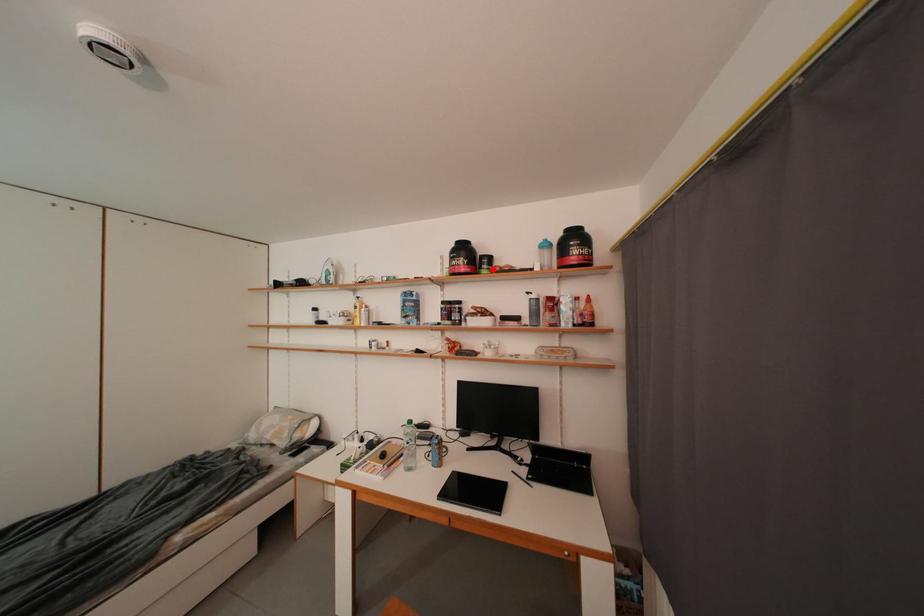
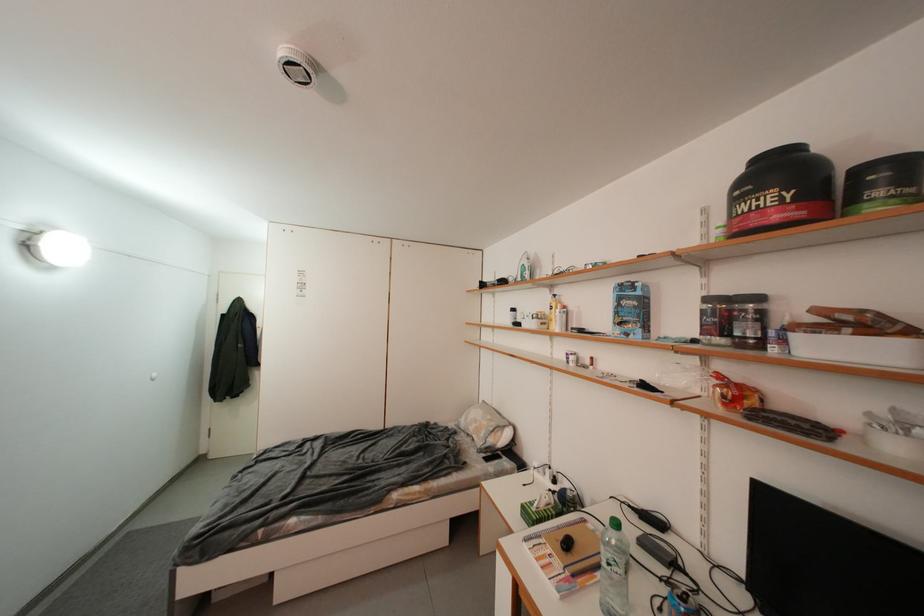
Where in the second image is the point corresponding to the highlighted location from the first image?

(886, 196)